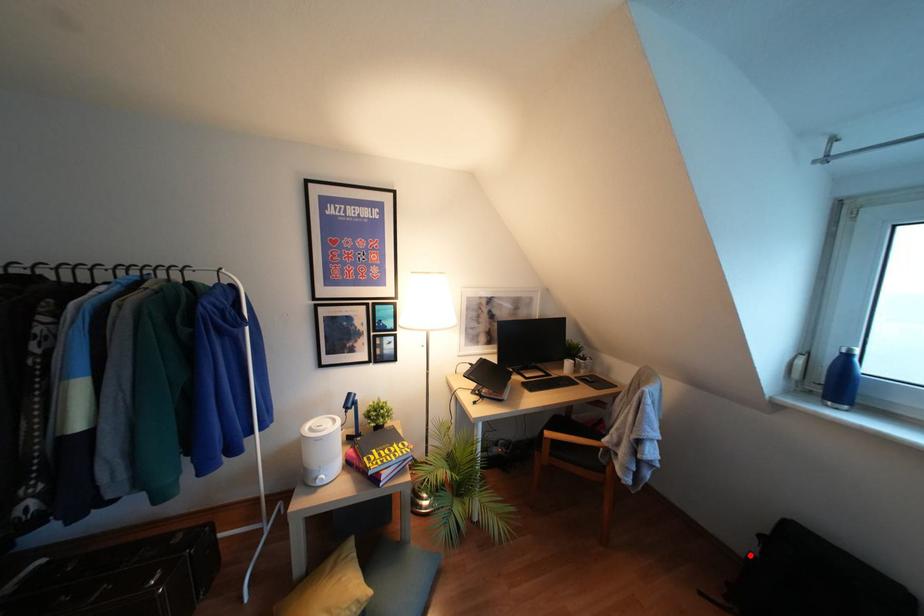
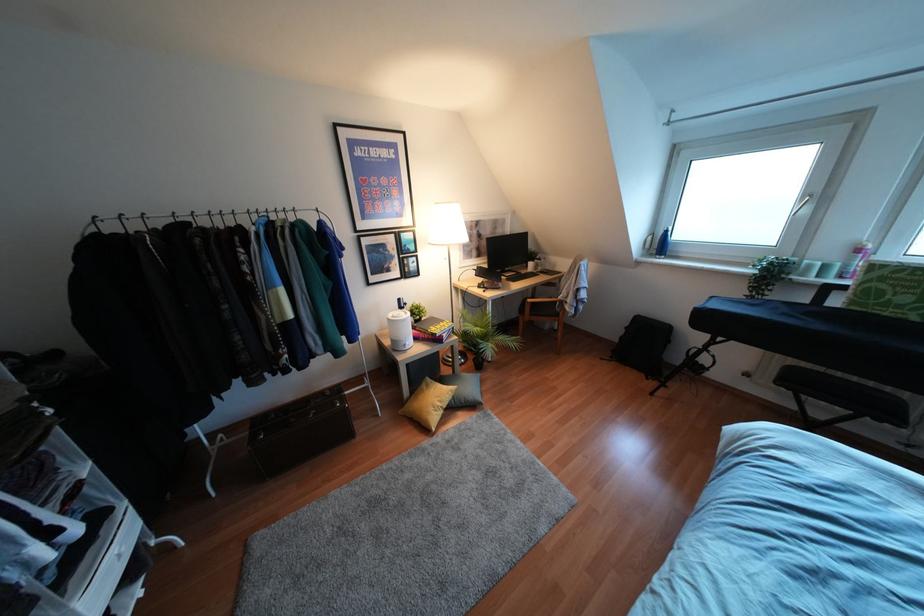
The point at the highlighted location is marked in the first image. Where is the corresponding point in the second image?

(621, 337)